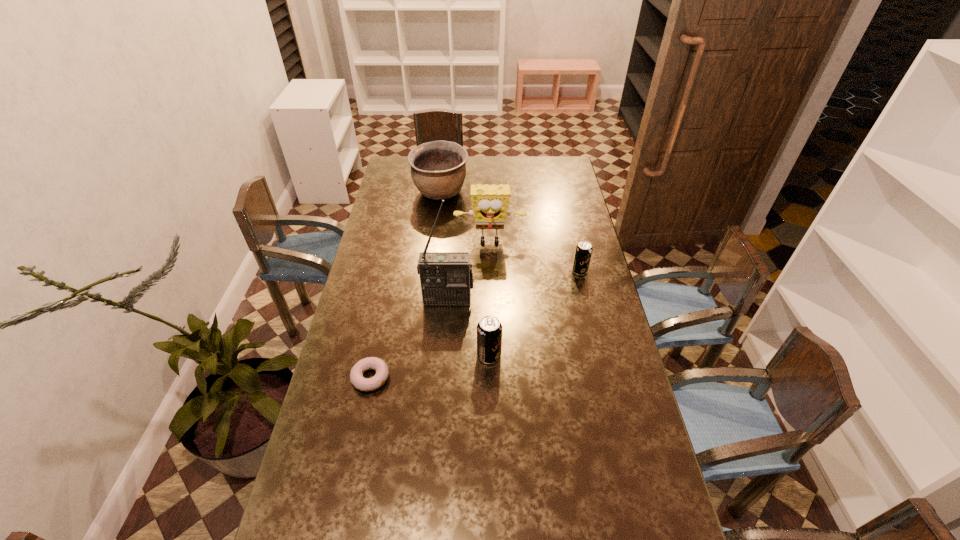
Please point a spot on the left to add another soda can. Please provide its 2D coordinates. Your answer should be formatted as a tuple, i.e. [(x, y)], where the tuple contains the x and y coordinates of a point satisfying the conditions above.

[(352, 483)]